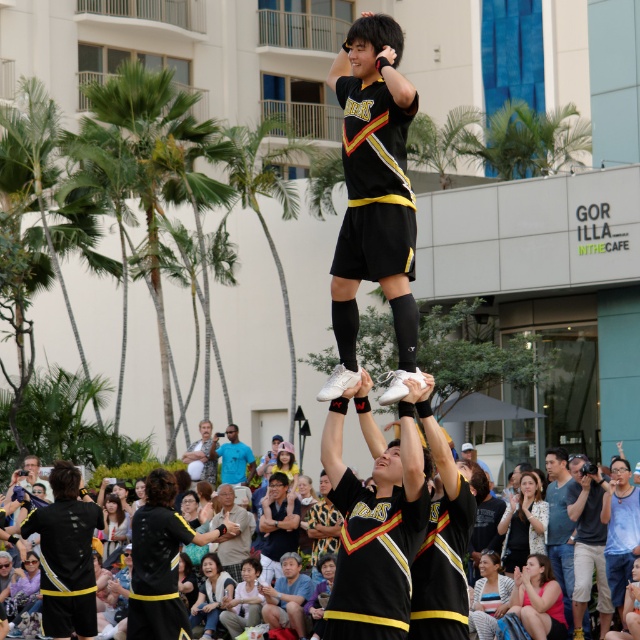
Find the location of a particular element. green leafy palm tree at left is located at coordinates (147, 170).

In the scene shown: Is green leafy palm tree at left wider than green leafy palm tree at center?

Indeed, green leafy palm tree at left has a greater width compared to green leafy palm tree at center.

Does point (145, 273) come in front of point (284, 195)?

Yes, point (145, 273) is in front of point (284, 195).

This screenshot has height=640, width=640. I want to click on green leafy palm tree at left, so click(147, 170).

Does point (404, 99) lie in front of point (241, 477)?

Yes.

Does black matte jersey at center come behind blue t-shirt at center?

That is False.

Does point (355, 182) come farther from viewer compared to point (252, 458)?

No, it is not.

Locate an element on the screen. black matte jersey at center is located at coordinates (372, 196).

Who is higher up, black matte jersey at center or beige textured shirt at center?

black matte jersey at center

Identify the location of black matte jersey at center. (372, 196).